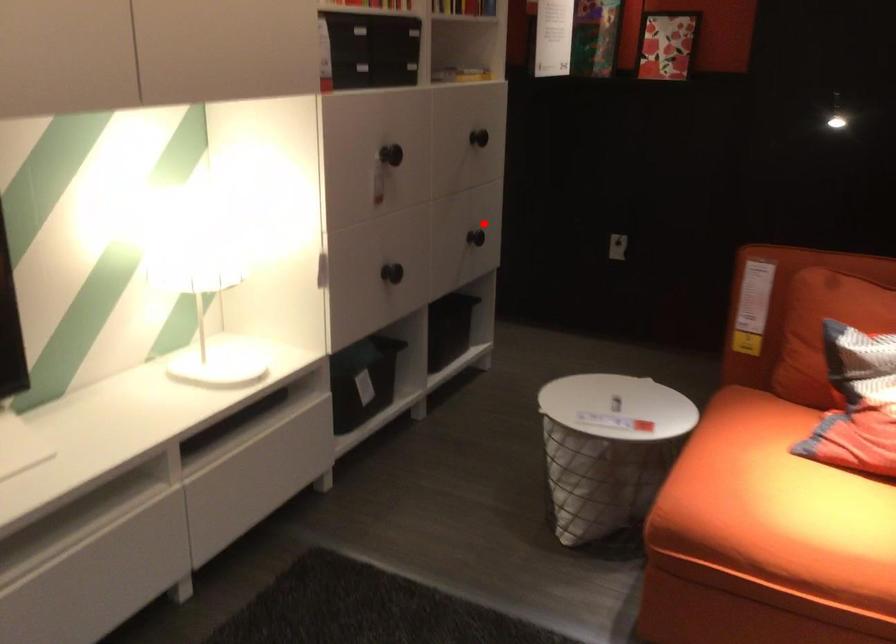
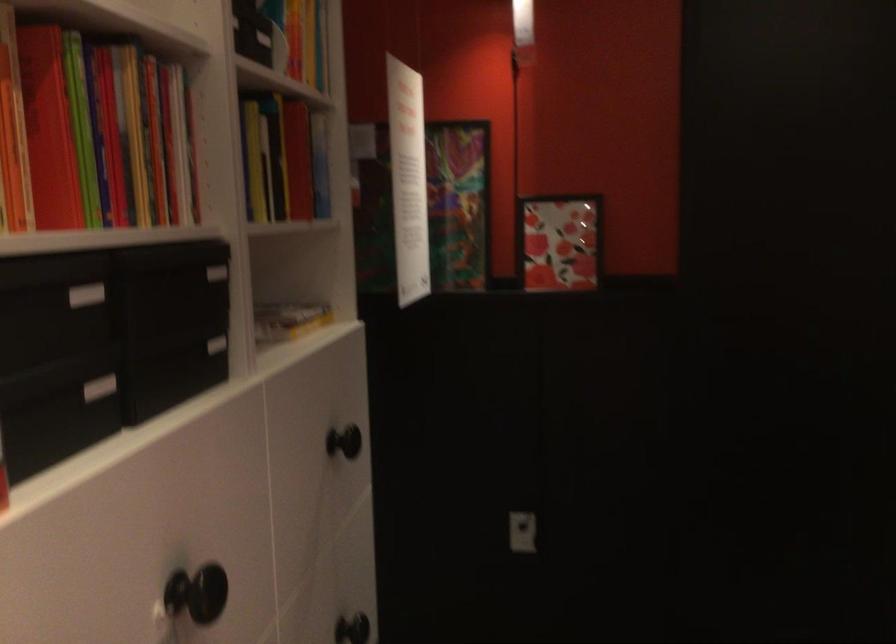
The point at the highlighted location is marked in the first image. Where is the corresponding point in the second image?

(351, 629)